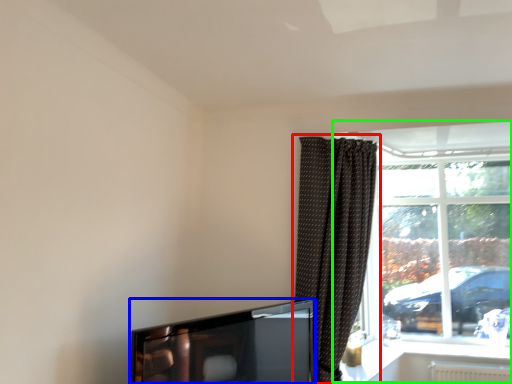
Question: Considering the real-world distances, which object is closest to curtain (highlighted by a red box)? television (highlighted by a blue box) or window (highlighted by a green box).

Choices:
 (A) television
 (B) window

Answer: (A)